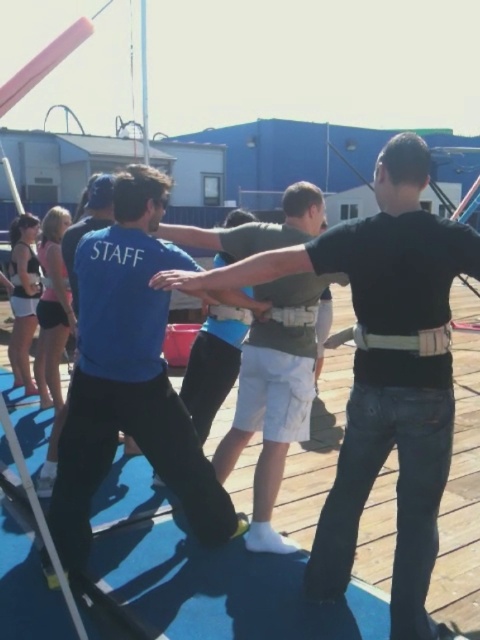
Between black matte shirt at center and blue fabric shirt at center, which one is positioned lower?

black matte shirt at center

Does black matte shirt at center have a smaller size compared to blue fabric shirt at center?

Actually, black matte shirt at center might be larger than blue fabric shirt at center.

Which is behind, point (434, 260) or point (199, 520)?

The point (199, 520) is behind.

Image resolution: width=480 pixels, height=640 pixels. Find the location of `black matte shirt at center`. black matte shirt at center is located at coordinates (383, 371).

Is blue fabric shirt at center above matte black tank top at left?

No, blue fabric shirt at center is not above matte black tank top at left.

What do you see at coordinates (129, 376) in the screenshot?
I see `blue fabric shirt at center` at bounding box center [129, 376].

Image resolution: width=480 pixels, height=640 pixels. I want to click on blue fabric shirt at center, so click(129, 376).

Can you confirm if black matte shirt at center is taller than matte black tank top at left?

Correct, black matte shirt at center is much taller as matte black tank top at left.

This screenshot has height=640, width=480. I want to click on black matte shirt at center, so click(383, 371).